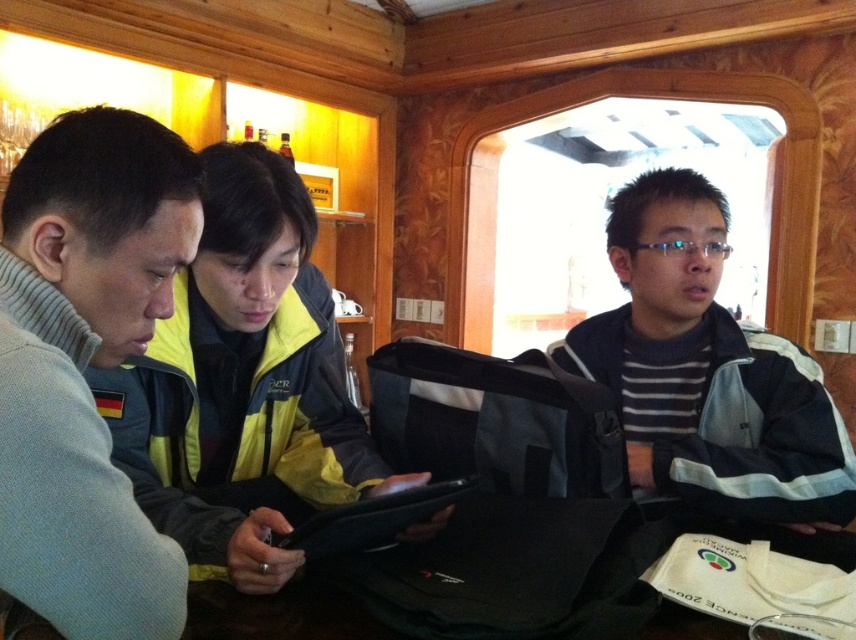
You are standing in the room and want to hand a document to both the matte gray sweater at left and the yellow reflective jacket at center. Which person should you approach first to ensure you can reach them without moving around the table?

You should approach the matte gray sweater at left first because it is closer to you than the yellow reflective jacket at center, so you can reach them without needing to move around the table.

You are trying to decide which sweater to take for a cold day. Based on the image, which of the two sweaters, the matte gray sweater at left or the striped knit sweater at center, is thicker and more suitable for cold weather?

The striped knit sweater at center is thicker than the matte gray sweater at left, making it more suitable for cold weather.